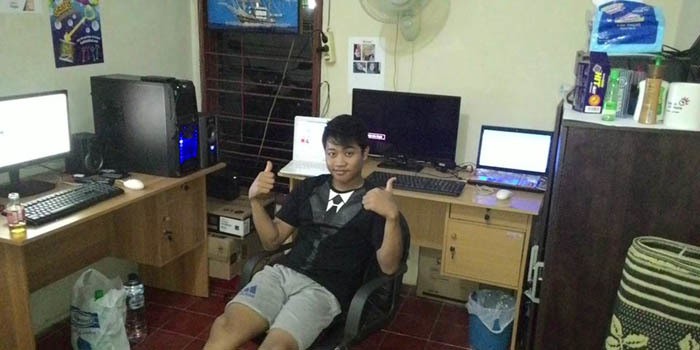
I want to click on desk, so click(x=512, y=264).